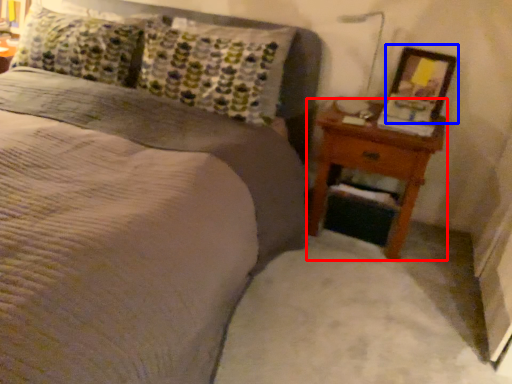
Question: Which of the following is the farthest to the observer, nightstand (highlighted by a red box) or picture frame (highlighted by a blue box)?

Choices:
 (A) nightstand
 (B) picture frame

Answer: (B)